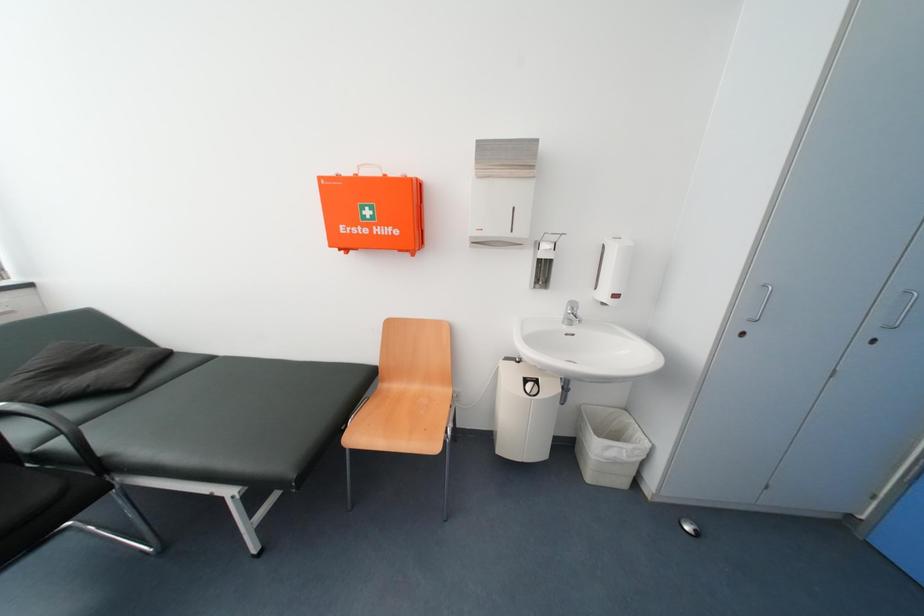
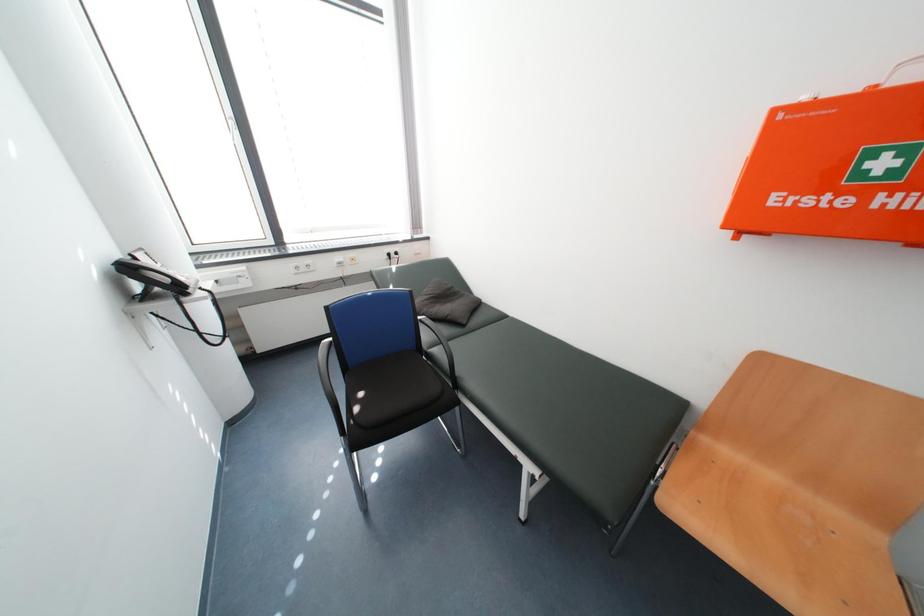
Question: Based on the continuous images, in which direction is the camera rotating? Reply with the corresponding letter.

Choices:
 (A) Left
 (B) Right
 (C) Up
 (D) Down

Answer: (A)